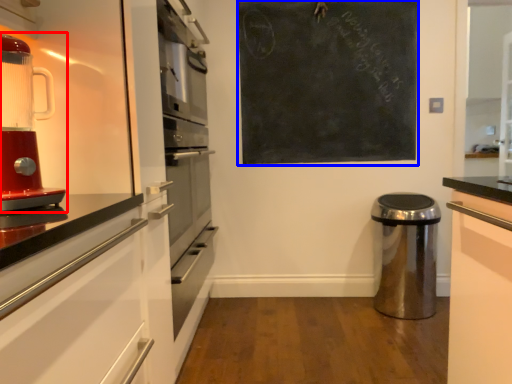
Question: Which of the following is the closest to the observer, home appliance (highlighted by a red box) or bulletin board (highlighted by a blue box)?

Choices:
 (A) home appliance
 (B) bulletin board

Answer: (A)